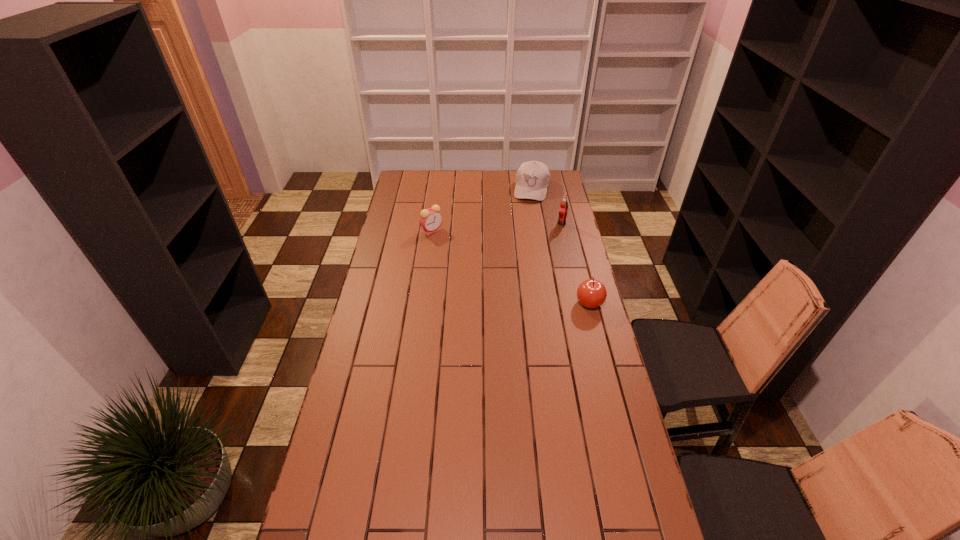
This screenshot has width=960, height=540. Find the location of `alarm clock`. alarm clock is located at coordinates click(x=430, y=219).

I want to click on the nearest object, so click(x=591, y=293).

The height and width of the screenshot is (540, 960). Find the location of `soda bottle`. soda bottle is located at coordinates pyautogui.click(x=563, y=209).

Locate an element on the screen. Image resolution: width=960 pixels, height=540 pixels. baseball cap is located at coordinates (532, 178).

At what (x,y) coordinates should I click in order to perform the action: click on vacant area situated 0.180m on the face of the leftmost object. Please return your answer as a coordinate pair (x, y). The image size is (960, 540). Looking at the image, I should click on (428, 261).

Where is `vacant space located on the left of the nearest object`? This screenshot has width=960, height=540. vacant space located on the left of the nearest object is located at coordinates (490, 303).

Find the location of a particular element. This screenshot has height=540, width=960. vacant space located 0.390m on the label of the tallest object is located at coordinates (510, 266).

You are a GUI agent. You are given a task and a screenshot of the screen. Output one action in this format:
    pyautogui.click(x=<x>, y=<y>)
    Task: Click on the free space located 0.240m on the label of the tallest object
    The image size is (960, 540).
    Given the screenshot: What is the action you would take?
    pyautogui.click(x=530, y=249)

Where is `free space located 0.300m on the label of the tallest object`? The image size is (960, 540). free space located 0.300m on the label of the tallest object is located at coordinates [522, 256].

Where is `vacant space located 0.270m on the front-facing side of the baseball cap`? vacant space located 0.270m on the front-facing side of the baseball cap is located at coordinates (523, 233).